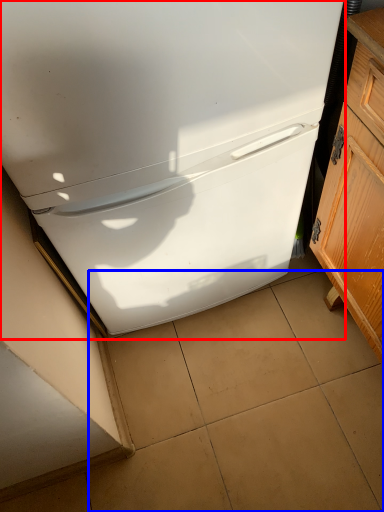
Question: Which object is further to the camera taking this photo, refrigerator (highlighted by a red box) or tile (highlighted by a blue box)?

Choices:
 (A) refrigerator
 (B) tile

Answer: (B)